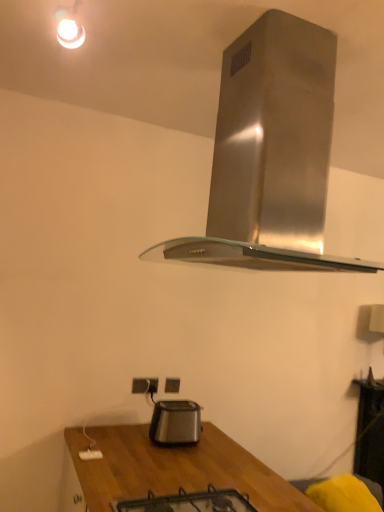
What is the approximate width of matte black electric outlet at lower center, arranged as the second electric outlet when viewed from the left?

The width of matte black electric outlet at lower center, arranged as the second electric outlet when viewed from the left, is 1.94 centimeters.

In order to face stainless steel range hood at upper center, should I rotate leftwards or rightwards?

Rotate right and turn 10.063 degrees.

Locate an element on the screen. The width and height of the screenshot is (384, 512). satin black toaster at lower center is located at coordinates (175, 422).

Where is `white plastic electric outlet at lower center, which is the 2th electric outlet in back-to-front order`? white plastic electric outlet at lower center, which is the 2th electric outlet in back-to-front order is located at coordinates (144, 385).

Identify the location of matte black electric outlet at lower center, marked as the 2th electric outlet in a front-to-back arrangement. The image size is (384, 512). click(x=172, y=385).

What's the angular difference between stainless steel range hood at upper center and white plastic electric outlet at lower center, arranged as the first electric outlet when viewed from the left,'s facing directions?

The angular difference between stainless steel range hood at upper center and white plastic electric outlet at lower center, arranged as the first electric outlet when viewed from the left, is 91 degrees.

Is point (300, 64) in front of point (156, 388)?

Yes, it is in front of point (156, 388).

Can we say stainless steel range hood at upper center lies outside white plastic electric outlet at lower center, arranged as the first electric outlet when viewed from the left?

Indeed, stainless steel range hood at upper center is completely outside white plastic electric outlet at lower center, arranged as the first electric outlet when viewed from the left.

Which object is positioned more to the left, stainless steel range hood at upper center or white plastic electric outlet at lower center, arranged as the first electric outlet when viewed from the left?

white plastic electric outlet at lower center, arranged as the first electric outlet when viewed from the left.

Is stainless steel range hood at upper center not inside black glass gas stove at lower center?

Yes, stainless steel range hood at upper center is outside of black glass gas stove at lower center.

Looking at this image, does stainless steel range hood at upper center lie behind black glass gas stove at lower center?

No, stainless steel range hood at upper center is closer to the camera.

Between stainless steel range hood at upper center and black glass gas stove at lower center, which one has smaller width?

Thinner between the two is black glass gas stove at lower center.

Does matte black electric outlet at lower center, marked as the 2th electric outlet in a front-to-back arrangement, turn towards satin black toaster at lower center?

Yes, matte black electric outlet at lower center, marked as the 2th electric outlet in a front-to-back arrangement, is oriented towards satin black toaster at lower center.

Which of these two, matte black electric outlet at lower center, placed as the first electric outlet when sorted from right to left, or satin black toaster at lower center, is smaller?

matte black electric outlet at lower center, placed as the first electric outlet when sorted from right to left.

At what (x,y) coordinates should I click in order to perform the action: click on kitchen appliance lying on the right of matte black electric outlet at lower center, marked as the 2th electric outlet in a front-to-back arrangement. Please return your answer as a coordinate pair (x, y). Looking at the image, I should click on (175, 422).

Based on the photo, is matte black electric outlet at lower center, the 1th electric outlet viewed from the back, to the left of satin black toaster at lower center from the viewer's perspective?

Correct, you'll find matte black electric outlet at lower center, the 1th electric outlet viewed from the back, to the left of satin black toaster at lower center.

Which of these two, satin black toaster at lower center or stainless steel range hood at upper center, is bigger?

With larger size is stainless steel range hood at upper center.

Which object is thinner, satin black toaster at lower center or stainless steel range hood at upper center?

With smaller width is satin black toaster at lower center.

Is satin black toaster at lower center in contact with stainless steel range hood at upper center?

No, satin black toaster at lower center is not making contact with stainless steel range hood at upper center.

Is point (161, 404) behind point (149, 259)?

No, it is in front of (149, 259).

Can you confirm if black glass gas stove at lower center is smaller than white plastic electric outlet at lower center, which is the 2th electric outlet in back-to-front order?

No, black glass gas stove at lower center is not smaller than white plastic electric outlet at lower center, which is the 2th electric outlet in back-to-front order.

Considering the points (139, 511) and (134, 393), which point is in front, point (139, 511) or point (134, 393)?

Positioned in front is point (139, 511).

Is black glass gas stove at lower center oriented towards white plastic electric outlet at lower center, which is the 2th electric outlet in back-to-front order?

No.

Is there a large distance between black glass gas stove at lower center and white plastic electric outlet at lower center, the second electric outlet in the right-to-left sequence?

No, black glass gas stove at lower center is not far away from white plastic electric outlet at lower center, the second electric outlet in the right-to-left sequence.

Can you tell me how much white plastic electric outlet at lower center, arranged as the first electric outlet when viewed from the left, and matte black electric outlet at lower center, marked as the 2th electric outlet in a front-to-back arrangement, differ in facing direction?

white plastic electric outlet at lower center, arranged as the first electric outlet when viewed from the left, and matte black electric outlet at lower center, marked as the 2th electric outlet in a front-to-back arrangement, are facing 0.767 degrees away from each other.

Considering the positions of objects white plastic electric outlet at lower center, which is the 2th electric outlet in back-to-front order, and matte black electric outlet at lower center, arranged as the second electric outlet when viewed from the left, in the image provided, who is more to the right, white plastic electric outlet at lower center, which is the 2th electric outlet in back-to-front order, or matte black electric outlet at lower center, arranged as the second electric outlet when viewed from the left,?

matte black electric outlet at lower center, arranged as the second electric outlet when viewed from the left.

Between point (151, 389) and point (167, 383), which one is positioned behind?

Point (167, 383)

From a real-world perspective, is white plastic electric outlet at lower center, arranged as the first electric outlet when viewed from the left, over matte black electric outlet at lower center, marked as the 2th electric outlet in a front-to-back arrangement?

Indeed, from a real-world perspective, white plastic electric outlet at lower center, arranged as the first electric outlet when viewed from the left, stands above matte black electric outlet at lower center, marked as the 2th electric outlet in a front-to-back arrangement.

Is point (199, 497) closer or farther from the camera than point (170, 378)?

Point (199, 497).

Which object is positioned more to the right, black glass gas stove at lower center or matte black electric outlet at lower center, placed as the first electric outlet when sorted from right to left?

From the viewer's perspective, black glass gas stove at lower center appears more on the right side.

Is black glass gas stove at lower center beside matte black electric outlet at lower center, the 1th electric outlet viewed from the back?

There is a gap between black glass gas stove at lower center and matte black electric outlet at lower center, the 1th electric outlet viewed from the back.

How different are the orientations of black glass gas stove at lower center and matte black electric outlet at lower center, marked as the 2th electric outlet in a front-to-back arrangement, in degrees?

black glass gas stove at lower center and matte black electric outlet at lower center, marked as the 2th electric outlet in a front-to-back arrangement, are facing 89.2 degrees away from each other.

The width and height of the screenshot is (384, 512). In the image, there is a white plastic electric outlet at lower center, the 1th electric outlet when ordered from front to back. In order to click on home appliance above it (from the image's perspective) in this screenshot , I will do `click(270, 154)`.

This screenshot has height=512, width=384. Find the location of `home appliance in front of the black glass gas stove at lower center`. home appliance in front of the black glass gas stove at lower center is located at coordinates click(270, 154).

Which object lies further to the anchor point satin black toaster at lower center, white plastic electric outlet at lower center, the second electric outlet in the right-to-left sequence, or stainless steel range hood at upper center?

stainless steel range hood at upper center is further to satin black toaster at lower center.

From the image, which object appears to be farther from satin black toaster at lower center, stainless steel range hood at upper center or matte black electric outlet at lower center, the 1th electric outlet viewed from the back?

Based on the image, stainless steel range hood at upper center appears to be further to satin black toaster at lower center.

Looking at the image, which one is located closer to white plastic electric outlet at lower center, the 1th electric outlet when ordered from front to back, stainless steel range hood at upper center or black glass gas stove at lower center?

black glass gas stove at lower center.

Estimate the real-world distances between objects in this image. Which object is further from white plastic electric outlet at lower center, arranged as the first electric outlet when viewed from the left, black glass gas stove at lower center or matte black electric outlet at lower center, the 1th electric outlet viewed from the back?

The object further to white plastic electric outlet at lower center, arranged as the first electric outlet when viewed from the left, is black glass gas stove at lower center.

Looking at the image, which one is located closer to black glass gas stove at lower center, matte black electric outlet at lower center, arranged as the second electric outlet when viewed from the left, or stainless steel range hood at upper center?

matte black electric outlet at lower center, arranged as the second electric outlet when viewed from the left, is closer to black glass gas stove at lower center.

Consider the image. Based on their spatial positions, is satin black toaster at lower center or white plastic electric outlet at lower center, the second electric outlet in the right-to-left sequence, closer to matte black electric outlet at lower center, marked as the 2th electric outlet in a front-to-back arrangement?

Based on the image, white plastic electric outlet at lower center, the second electric outlet in the right-to-left sequence, appears to be nearer to matte black electric outlet at lower center, marked as the 2th electric outlet in a front-to-back arrangement.

Looking at the image, which one is located closer to satin black toaster at lower center, white plastic electric outlet at lower center, the 1th electric outlet when ordered from front to back, or black glass gas stove at lower center?

white plastic electric outlet at lower center, the 1th electric outlet when ordered from front to back, is closer to satin black toaster at lower center.

Estimate the real-world distances between objects in this image. Which object is further from white plastic electric outlet at lower center, the 1th electric outlet when ordered from front to back, stainless steel range hood at upper center or satin black toaster at lower center?

The object further to white plastic electric outlet at lower center, the 1th electric outlet when ordered from front to back, is stainless steel range hood at upper center.

You are a GUI agent. You are given a task and a screenshot of the screen. Output one action in this format:
    pyautogui.click(x=<x>, y=<y>)
    Task: Click on the electric outlet between stainless steel range hood at upper center and matte black electric outlet at lower center, placed as the first electric outlet when sorted from right to left, along the z-axis
    
    Given the screenshot: What is the action you would take?
    pyautogui.click(x=144, y=385)

This screenshot has width=384, height=512. I want to click on kitchen appliance between stainless steel range hood at upper center and matte black electric outlet at lower center, marked as the 2th electric outlet in a front-to-back arrangement, from front to back, so click(175, 422).

Where is `gas stove between stainless steel range hood at upper center and white plastic electric outlet at lower center, the 1th electric outlet when ordered from front to back, along the z-axis`? This screenshot has width=384, height=512. gas stove between stainless steel range hood at upper center and white plastic electric outlet at lower center, the 1th electric outlet when ordered from front to back, along the z-axis is located at coordinates (189, 502).

This screenshot has height=512, width=384. I want to click on electric outlet between satin black toaster at lower center and matte black electric outlet at lower center, placed as the first electric outlet when sorted from right to left, in the front-back direction, so click(x=144, y=385).